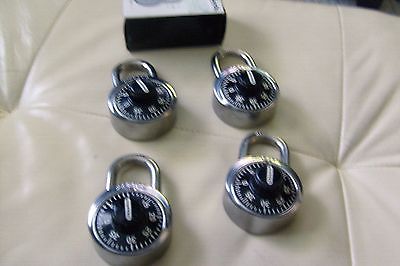
I want to click on cushion sunk in, so click(337, 167), click(9, 105).